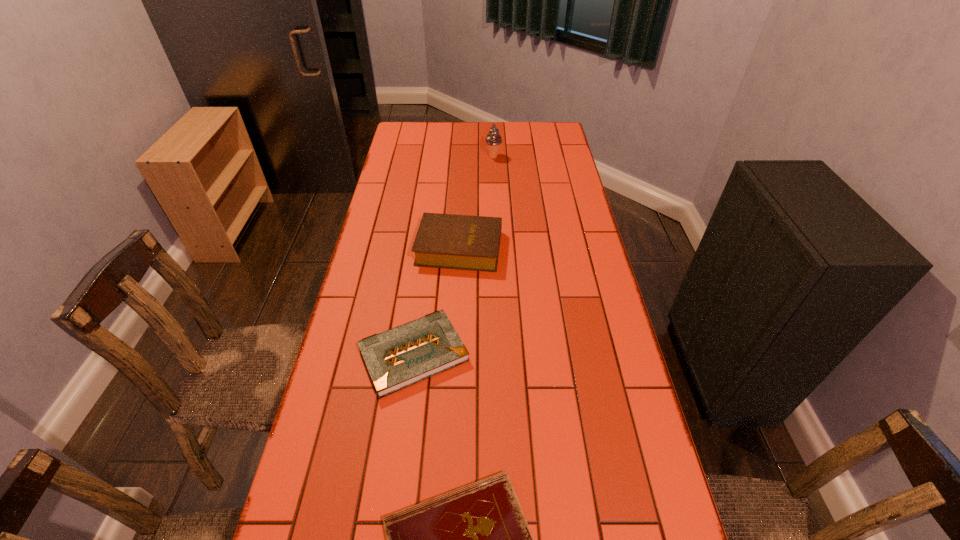
Locate an element on the screen. The image size is (960, 540). vacant area between the Bible and the taller notebook is located at coordinates (437, 301).

This screenshot has width=960, height=540. In order to click on empty location between the farthest object and the second farthest object in this screenshot , I will do `click(476, 202)`.

Where is `free space between the farthest object and the second farthest object`? The height and width of the screenshot is (540, 960). free space between the farthest object and the second farthest object is located at coordinates (476, 202).

In order to click on the closest object relative to the second shortest object in this screenshot , I will do `click(475, 539)`.

Choose which object is the second nearest neighbor to the shorter notebook. Please provide its 2D coordinates. Your answer should be formatted as a tuple, i.e. [(x, y)], where the tuple contains the x and y coordinates of a point satisfying the conditions above.

[(463, 242)]

Where is `vacant position in the image that satisfies the following two spatial constraints: 1. on the back side of the Bible; 2. on the right side of the taller notebook`? The width and height of the screenshot is (960, 540). vacant position in the image that satisfies the following two spatial constraints: 1. on the back side of the Bible; 2. on the right side of the taller notebook is located at coordinates (427, 248).

This screenshot has width=960, height=540. I want to click on vacant region that satisfies the following two spatial constraints: 1. on the back side of the farther notebook; 2. on the right side of the tallest object, so click(x=439, y=157).